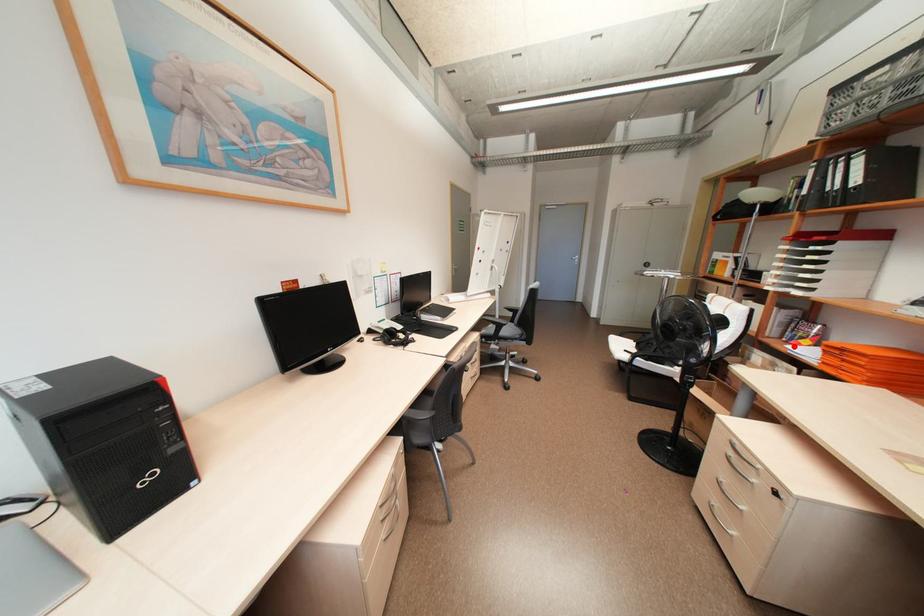
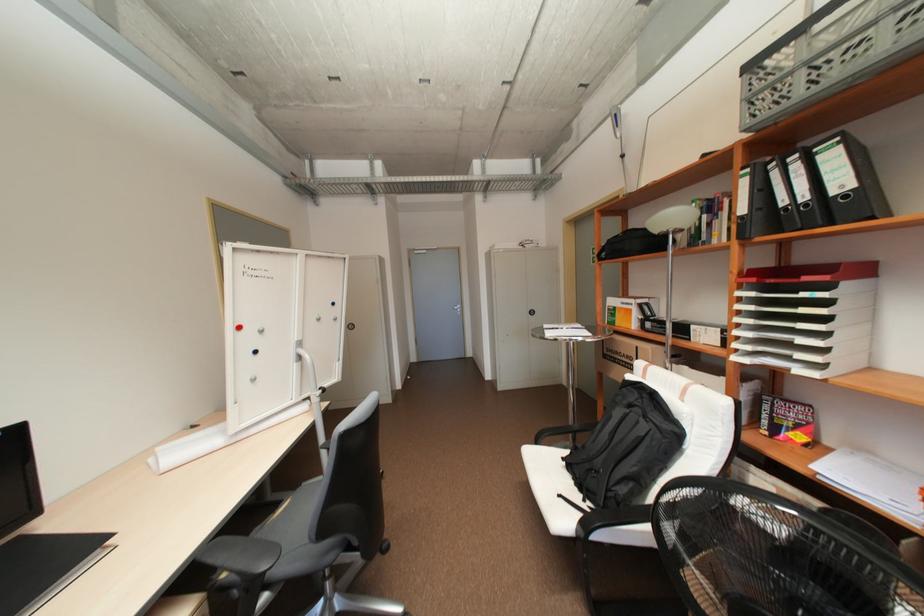
Locate, in the second image, the point that corresponds to the highlighted location in the first image.

(820, 467)